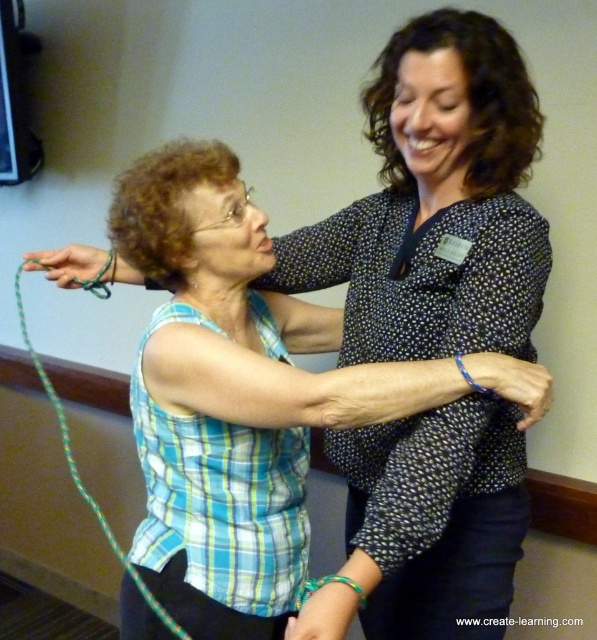
Question: Can you confirm if blue woven bracelet at center is smaller than matte green rope at upper left?

Choices:
 (A) no
 (B) yes

Answer: (B)

Question: Does blue woven bracelet at center have a smaller size compared to green braided string at left?

Choices:
 (A) no
 (B) yes

Answer: (B)

Question: Considering the real-world distances, which object is farthest from the green braided string at left?

Choices:
 (A) matte green rope at upper left
 (B) blue woven bracelet at center

Answer: (B)

Question: Considering the real-world distances, which object is farthest from the blue woven bracelet at center?

Choices:
 (A) green braided string at left
 (B) matte green rope at upper left

Answer: (A)

Question: Which point appears farthest from the camera in this image?

Choices:
 (A) (466, 362)
 (B) (113, 280)
 (C) (54, 410)

Answer: (C)

Question: Can you confirm if matte green rope at upper left is thinner than green braided string at left?

Choices:
 (A) no
 (B) yes

Answer: (A)